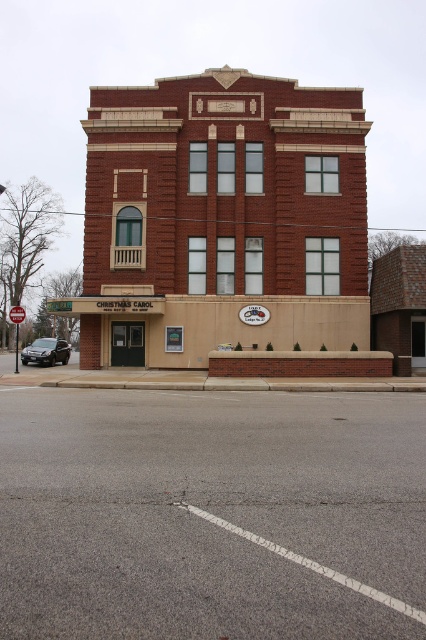
You are standing in front of a historic building and want to take a photo of the point at coordinates point (57, 352). If your camera has a maximum focus range of 35 meters, will you be able to capture the point clearly?

The distance between point (57, 352) and the camera is 37.51 meters, which exceeds the camera maximum focus range of 35 meters. Therefore, you won waiting to move closer to capture the point clearly.

You are driving a car and see the satin black sedan at lower left and the brushed metal stop sign at upper center in your view. Which object is closer to the road surface?

The satin black sedan at lower left is closer to the road surface because it is positioned under the brushed metal stop sign at upper center.